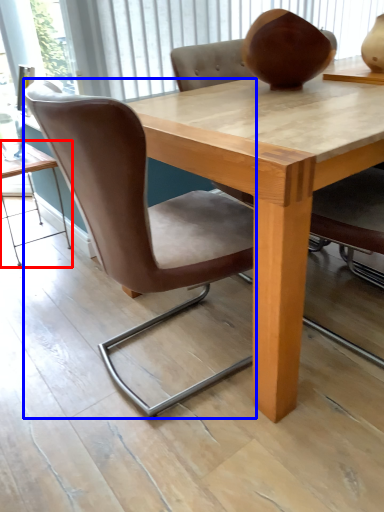
Question: Among these objects, which one is nearest to the camera, table (highlighted by a red box) or chair (highlighted by a blue box)?

Choices:
 (A) table
 (B) chair

Answer: (B)